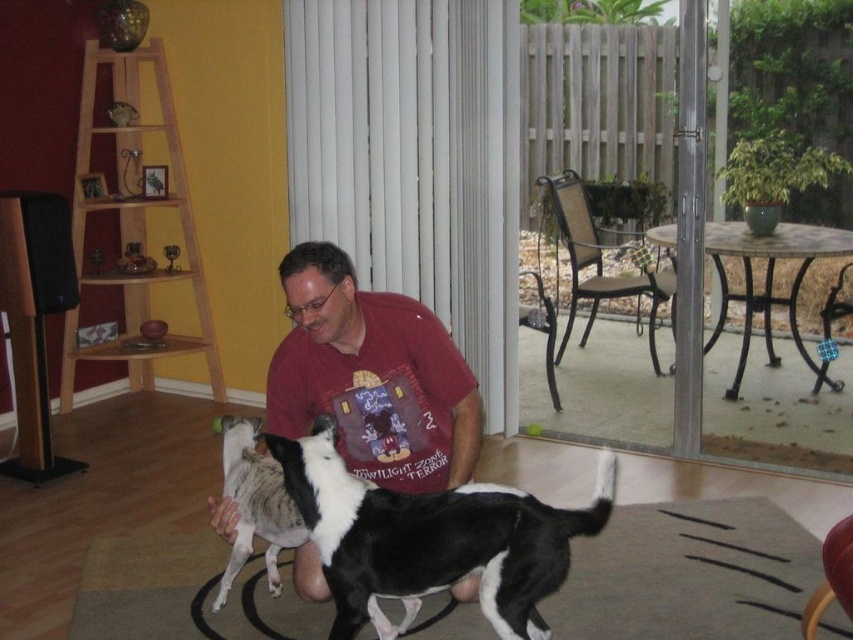
Question: In this image, where is matte red shirt at center located relative to black and white fur dog at center?

Choices:
 (A) right
 (B) left

Answer: (B)

Question: Which of these objects is positioned farthest from the matte red shirt at center?

Choices:
 (A) black and white fur dog at center
 (B) clear glass screen door at right

Answer: (B)

Question: Which object appears closest to the camera in this image?

Choices:
 (A) black and white fur dog at center
 (B) matte red shirt at center
 (C) soft beige rug at lower center
 (D) clear glass screen door at right

Answer: (A)

Question: Estimate the real-world distances between objects in this image. Which object is farther from the soft beige rug at lower center?

Choices:
 (A) matte red shirt at center
 (B) clear glass screen door at right

Answer: (B)

Question: Is clear glass screen door at right to the right of black and white fur dog at center from the viewer's perspective?

Choices:
 (A) yes
 (B) no

Answer: (A)

Question: Can you confirm if matte red shirt at center is bigger than black and white fur dog at center?

Choices:
 (A) yes
 (B) no

Answer: (B)